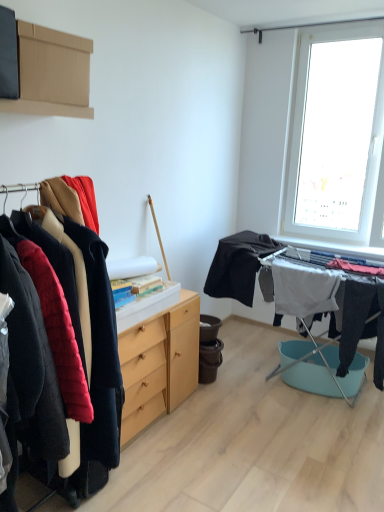
Question: Considering the relative positions of black matte fabric at center, which appears as the 1th clothing when viewed from the left, and white fabric at center, the 2th clothing viewed from the left, in the image provided, is black matte fabric at center, which appears as the 1th clothing when viewed from the left, to the left or to the right of white fabric at center, the 2th clothing viewed from the left,?

Choices:
 (A) left
 (B) right

Answer: (A)

Question: Is black matte fabric at center, the 2th clothing in the right-to-left sequence, wider or thinner than white fabric at center, the first clothing in the right-to-left sequence?

Choices:
 (A) wide
 (B) thin

Answer: (A)

Question: Based on their relative distances, which object is nearer to the black matte fabric at center, the 2th clothing in the right-to-left sequence?

Choices:
 (A) light wood chest of drawers at center
 (B) brown cardboard box at upper left
 (C) white fabric at center, the first clothing in the right-to-left sequence

Answer: (C)

Question: Which object is positioned farthest from the white fabric at center, the first clothing in the right-to-left sequence?

Choices:
 (A) light wood chest of drawers at center
 (B) black matte fabric at center, which appears as the 1th clothing when viewed from the left
 (C) brown cardboard box at upper left

Answer: (C)